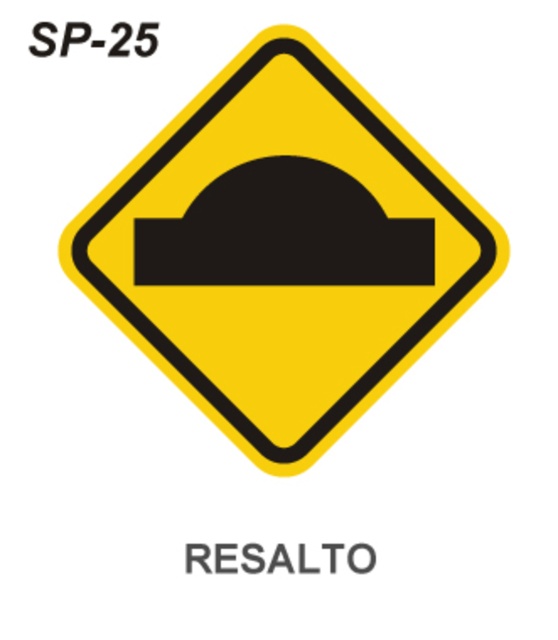
At what (x,y) coordinates should I click in order to perform the action: click on yellow matte road sign at center. Please return your answer as a coordinate pair (x, y). The image size is (558, 640). Looking at the image, I should click on (282, 250).

Which is behind, point (237, 241) or point (315, 246)?

The point (315, 246) is behind.

Between point (105, 232) and point (282, 157), which one is positioned behind?

The point (282, 157) is more distant.

This screenshot has width=558, height=640. I want to click on yellow matte road sign at center, so click(x=282, y=250).